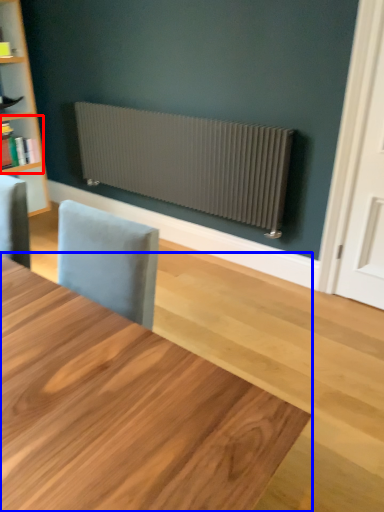
Question: Which object is closer to the camera taking this photo, shelf (highlighted by a red box) or table (highlighted by a blue box)?

Choices:
 (A) shelf
 (B) table

Answer: (B)